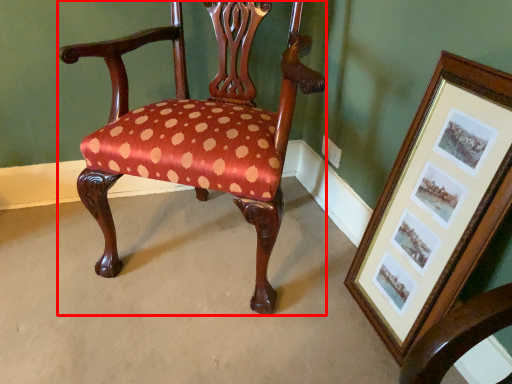
Question: From the image's perspective, what is the correct spatial relationship of chair (annotated by the red box) in relation to picture frame?

Choices:
 (A) above
 (B) below

Answer: (A)